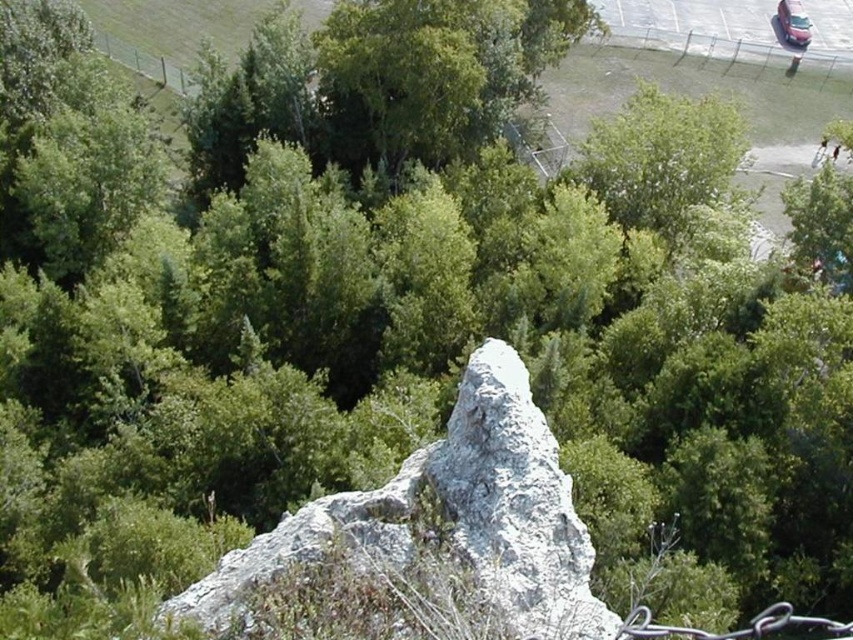
Question: Is white rough rock at center above metallic silver car at upper right?

Choices:
 (A) no
 (B) yes

Answer: (A)

Question: Considering the relative positions of white rough rock at center and metallic silver car at upper right in the image provided, where is white rough rock at center located with respect to metallic silver car at upper right?

Choices:
 (A) above
 (B) below

Answer: (B)

Question: Among these points, which one is farthest from the camera?

Choices:
 (A) (798, 22)
 (B) (405, 509)

Answer: (A)

Question: Which point is farther to the camera?

Choices:
 (A) white rough rock at center
 (B) metallic silver car at upper right

Answer: (B)

Question: Can you confirm if white rough rock at center is positioned to the right of metallic silver car at upper right?

Choices:
 (A) no
 (B) yes

Answer: (A)